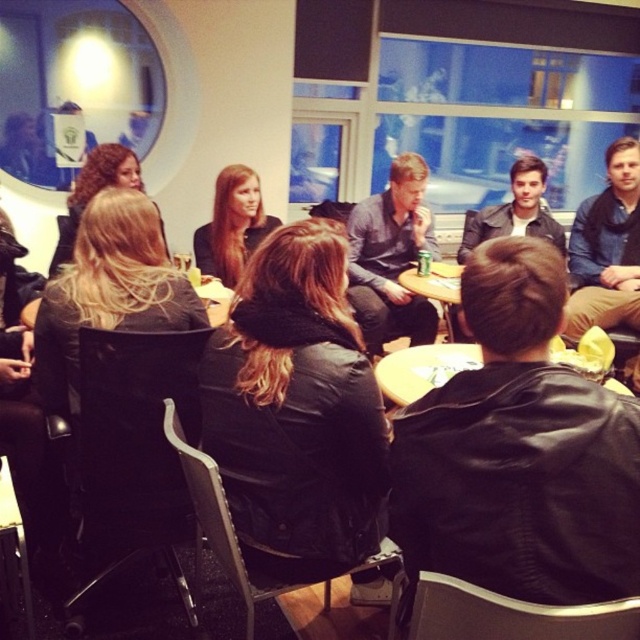
You are standing at the center of the room and want to place a new decorative item at point (108, 291). What object is currently located there?

The black leather jacket at left is located at point 0.450, 0.170.

You are a photographer trying to capture a candid shot of the black leather jacket at lower right and smooth brown hair at center. Since you want to ensure both subjects are in focus, you need to know their relative heights. Which one is taller?

The black leather jacket at lower right is much taller than the smooth brown hair at center.

You are organizing a photo shoot and need to position two jackets for a catalog. The scene shows a black leather jacket at left and a blue denim jacket at upper right. According to the image, which jacket is positioned to the left of the other?

The black leather jacket at left is positioned to the left of the blue denim jacket at upper right.